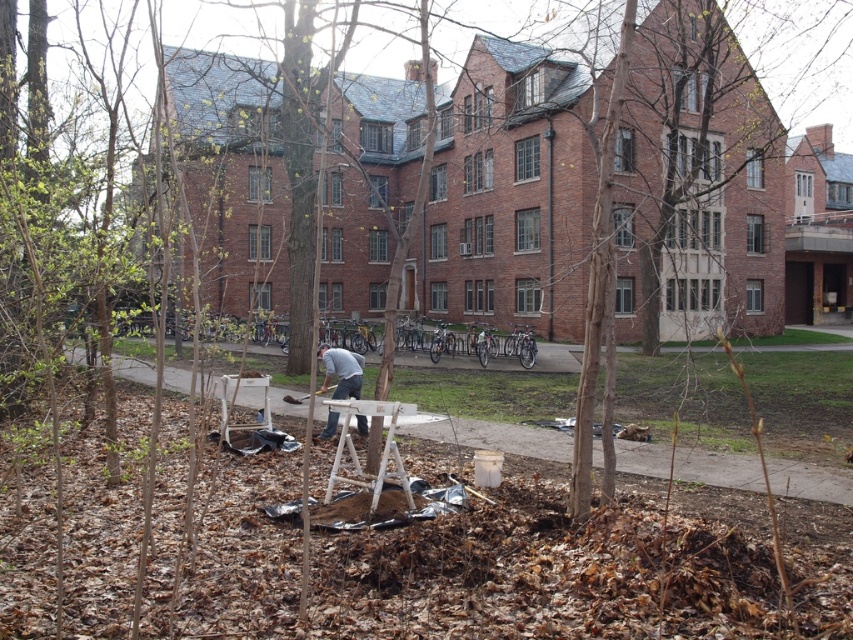
Question: Is white wood easel at center to the left of gray fabric at center from the viewer's perspective?

Choices:
 (A) yes
 (B) no

Answer: (B)

Question: Is white wood easel at center below gray fabric at center?

Choices:
 (A) yes
 (B) no

Answer: (B)

Question: Which point is farther to the camera?

Choices:
 (A) (338, 396)
 (B) (357, 413)

Answer: (A)

Question: Considering the relative positions of white wood easel at center and gray fabric at center in the image provided, where is white wood easel at center located with respect to gray fabric at center?

Choices:
 (A) left
 (B) right

Answer: (B)

Question: Which object is farther from the camera taking this photo?

Choices:
 (A) gray fabric at center
 (B) white wood easel at center

Answer: (A)

Question: Which object appears closest to the camera in this image?

Choices:
 (A) gray fabric at center
 (B) white wood easel at center

Answer: (B)